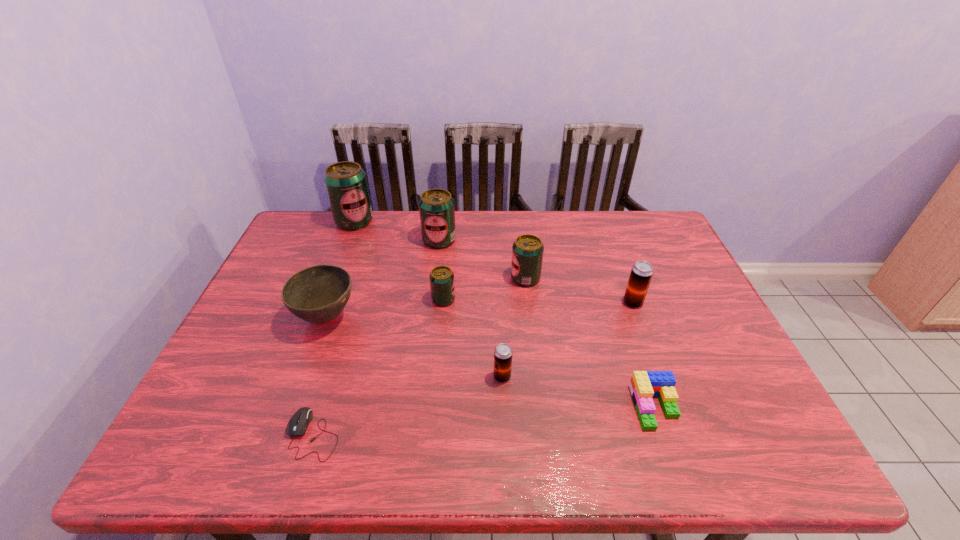
Where is `vacant space at the near edge of the desktop`? The width and height of the screenshot is (960, 540). vacant space at the near edge of the desktop is located at coordinates (628, 447).

I want to click on vacant area at the left edge of the desktop, so click(x=233, y=405).

In the image, there is a desktop. Identify the location of vacant area at the right edge. This screenshot has height=540, width=960. (708, 307).

What are the coordinates of `free space at the far left corner of the desktop` in the screenshot? It's located at (330, 220).

The width and height of the screenshot is (960, 540). I want to click on free spot at the far right corner of the desktop, so click(x=634, y=219).

Image resolution: width=960 pixels, height=540 pixels. Find the location of `free space that is in between the nearer black beer can and the rightmost beer can`. free space that is in between the nearer black beer can and the rightmost beer can is located at coordinates (567, 340).

Identify the location of unoccupied area between the eighth tallest object and the nearest green beer can. The height and width of the screenshot is (540, 960). (549, 353).

This screenshot has height=540, width=960. I want to click on vacant area that lies between the third smallest green beer can and the seventh nearest object, so click(x=482, y=259).

This screenshot has width=960, height=540. What are the coordinates of `vacant space that is in between the tallest object and the Lego` in the screenshot? It's located at (505, 314).

The height and width of the screenshot is (540, 960). Identify the location of vacant area between the nearest green beer can and the farther black beer can. (539, 301).